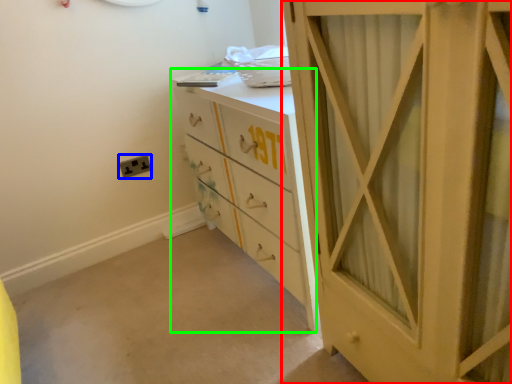
Question: Based on their relative distances, which object is nearer to cupboard (highlighted by a red box)? Choose from electric outlet (highlighted by a blue box) and chest of drawers (highlighted by a green box).

Choices:
 (A) electric outlet
 (B) chest of drawers

Answer: (B)